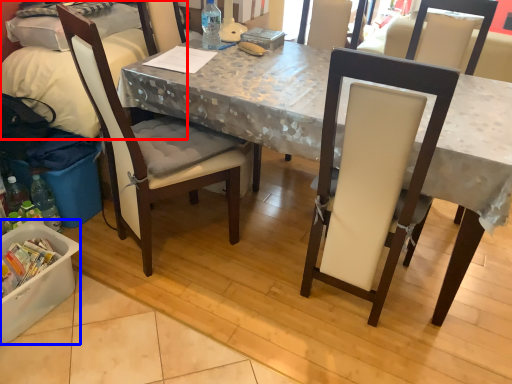
Question: Which object is further to the camera taking this photo, leftover (highlighted by a red box) or box (highlighted by a blue box)?

Choices:
 (A) leftover
 (B) box

Answer: (A)